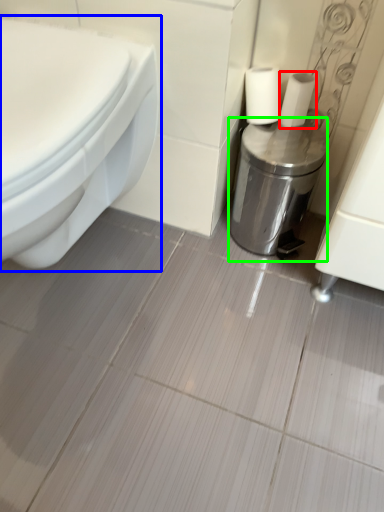
Question: Which object is positioned closest to toilet paper (highlighted by a red box)? Select from toilet (highlighted by a blue box) and dispenser (highlighted by a green box).

Choices:
 (A) toilet
 (B) dispenser

Answer: (B)